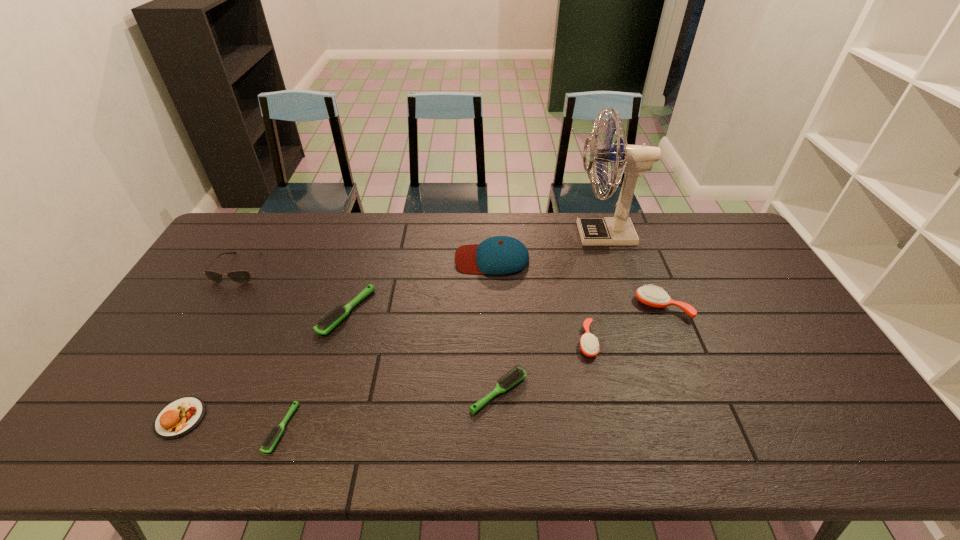
The width and height of the screenshot is (960, 540). Identify the location of free space between the shortest object and the fan. (443, 331).

This screenshot has width=960, height=540. Find the location of `vacant area that lies between the baseball cap and the smaller orange hairbrush`. vacant area that lies between the baseball cap and the smaller orange hairbrush is located at coordinates (540, 300).

Where is `vacant space in between the left orange hairbrush and the farthest light hairbrush`? vacant space in between the left orange hairbrush and the farthest light hairbrush is located at coordinates (467, 327).

Find the location of a particular element. Image resolution: width=960 pixels, height=540 pixels. empty space that is in between the second tallest object and the third object from right to left is located at coordinates tap(540, 300).

Identify the location of free space between the eighth shortest object and the seventh object from left to right. click(x=540, y=300).

This screenshot has width=960, height=540. Find the location of `free space between the smallest light hairbrush and the right orange hairbrush`. free space between the smallest light hairbrush and the right orange hairbrush is located at coordinates (472, 368).

The width and height of the screenshot is (960, 540). What are the coordinates of `vacant space in between the patty (food) and the smaller orange hairbrush` in the screenshot? It's located at (384, 380).

Identify the location of free spot between the right orange hairbrush and the baseball cap. The height and width of the screenshot is (540, 960). (577, 283).

Find the location of `object that stands as the third closest to the eighth shortest object`. object that stands as the third closest to the eighth shortest object is located at coordinates (329, 320).

Where is `object that is the second closest to the farther orange hairbrush`? This screenshot has width=960, height=540. object that is the second closest to the farther orange hairbrush is located at coordinates (633, 160).